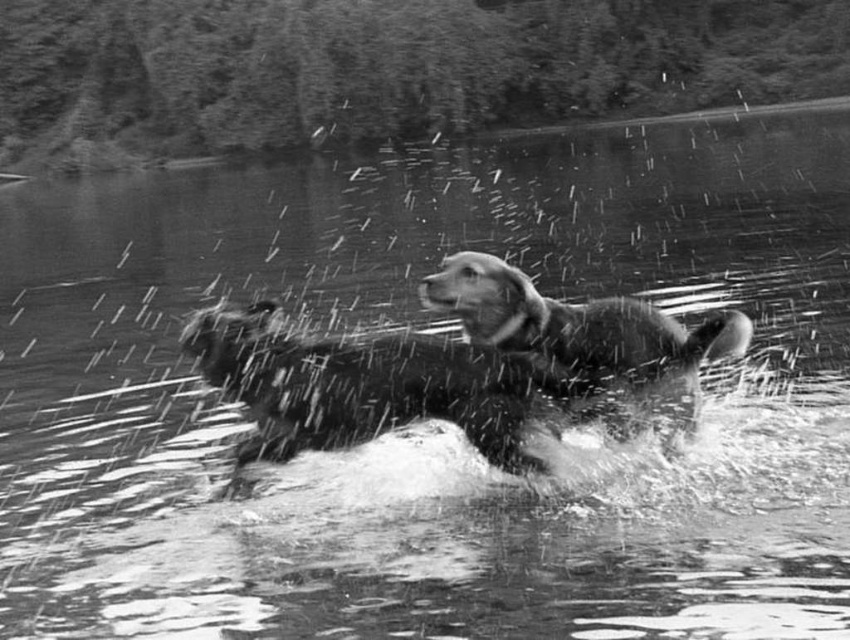
Question: Is fluffy wet dog at center above soft fur dog at center?

Choices:
 (A) no
 (B) yes

Answer: (A)

Question: Can you confirm if fluffy wet dog at center is bigger than soft fur dog at center?

Choices:
 (A) no
 (B) yes

Answer: (B)

Question: Which object is closer to the camera taking this photo?

Choices:
 (A) soft fur dog at center
 (B) fluffy wet dog at center

Answer: (A)

Question: Among these objects, which one is farthest from the camera?

Choices:
 (A) soft fur dog at center
 (B) fluffy wet dog at center

Answer: (B)

Question: Does fluffy wet dog at center have a greater width compared to soft fur dog at center?

Choices:
 (A) no
 (B) yes

Answer: (B)